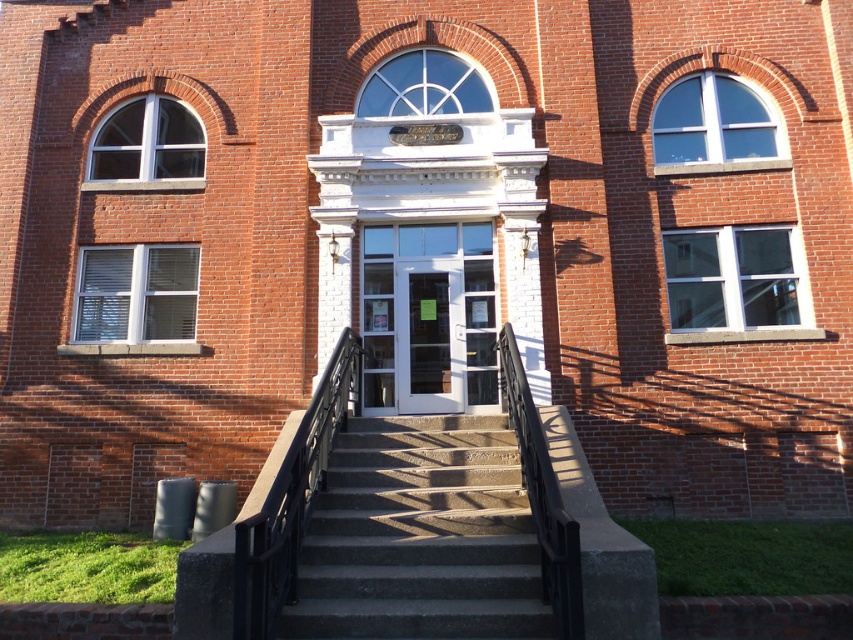
Between concrete/steps at center and black metal/rail at center, which one appears on the left side from the viewer's perspective?

Positioned to the left is black metal/rail at center.

Can you confirm if concrete/steps at center is wider than black metal/rail at center?

Indeed, concrete/steps at center has a greater width compared to black metal/rail at center.

Between point (439, 528) and point (318, 380), which one is positioned in front?

Point (439, 528) is in front.

You are a GUI agent. You are given a task and a screenshot of the screen. Output one action in this format:
    pyautogui.click(x=<x>, y=<y>)
    Task: Click on the concrete/steps at center
    
    Given the screenshot: What is the action you would take?
    pyautogui.click(x=421, y=536)

Between concrete/steps at center and white glass door at center, which one has less height?

Standing shorter between the two is concrete/steps at center.

Is point (404, 620) more distant than point (393, 278)?

That is False.

The height and width of the screenshot is (640, 853). Identify the location of concrete/steps at center. (421, 536).

Is white glass door at center thinner than black metal/rail at center?

In fact, white glass door at center might be wider than black metal/rail at center.

Can you confirm if white glass door at center is positioned above black metal/rail at center?

Correct, white glass door at center is located above black metal/rail at center.

Which is in front, point (390, 369) or point (297, 442)?

Point (297, 442) is in front.

Where is `white glass door at center`? white glass door at center is located at coordinates (428, 317).